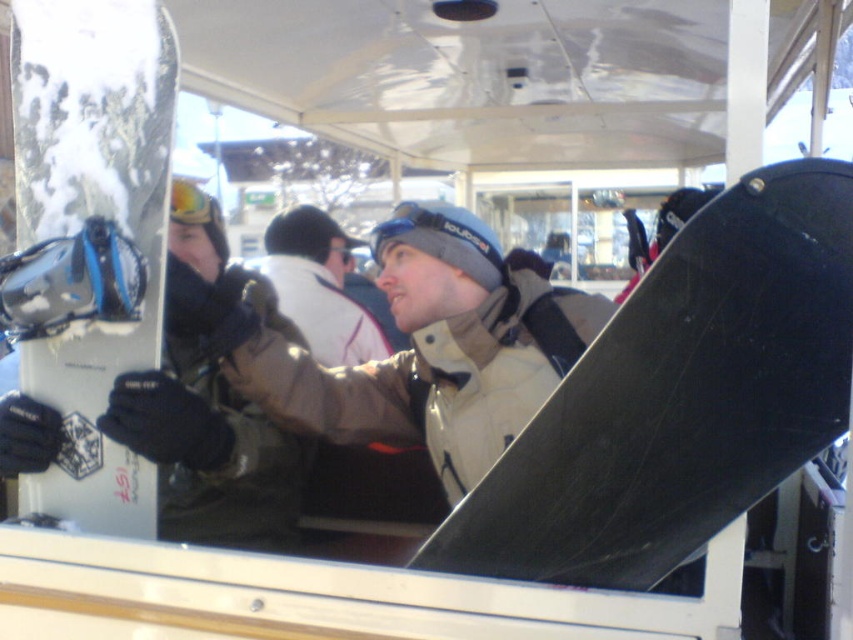
Question: Can you confirm if white matte snowboard at left is smaller than white fleece jacket at center?

Choices:
 (A) yes
 (B) no

Answer: (A)

Question: In this image, where is matte black snowboard at left located relative to white fleece jacket at center?

Choices:
 (A) left
 (B) right

Answer: (A)

Question: Is black matte snowboard at center behind matte beige jacket at center?

Choices:
 (A) no
 (B) yes

Answer: (A)

Question: Estimate the real-world distances between objects in this image. Which object is farther from the white fleece jacket at center?

Choices:
 (A) matte black snowboard at left
 (B) black matte snowboard at center

Answer: (B)

Question: Which object is positioned farthest from the white matte snowboard at left?

Choices:
 (A) matte beige jacket at center
 (B) matte black snowboard at left
 (C) black matte snowboard at center
 (D) white fleece jacket at center

Answer: (D)

Question: Among these objects, which one is farthest from the camera?

Choices:
 (A) matte black snowboard at left
 (B) white matte snowboard at left
 (C) white fleece jacket at center
 (D) black matte snowboard at center

Answer: (C)